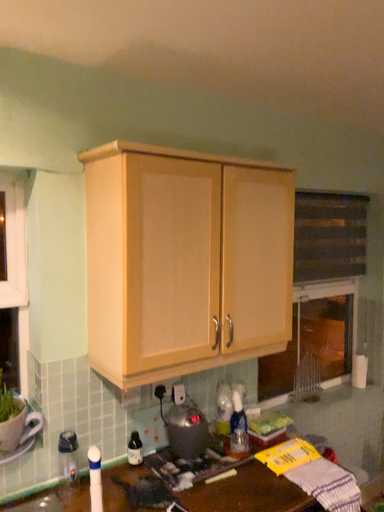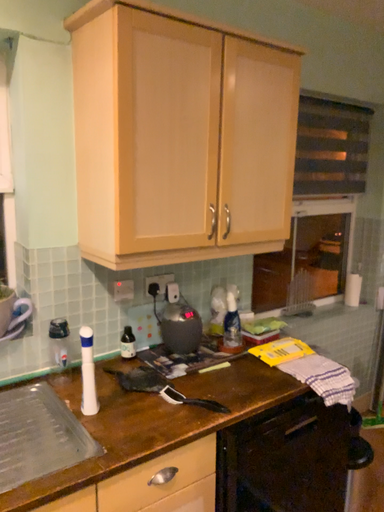
Question: How did the camera likely rotate when shooting the video?

Choices:
 (A) rotated upward
 (B) rotated downward

Answer: (B)